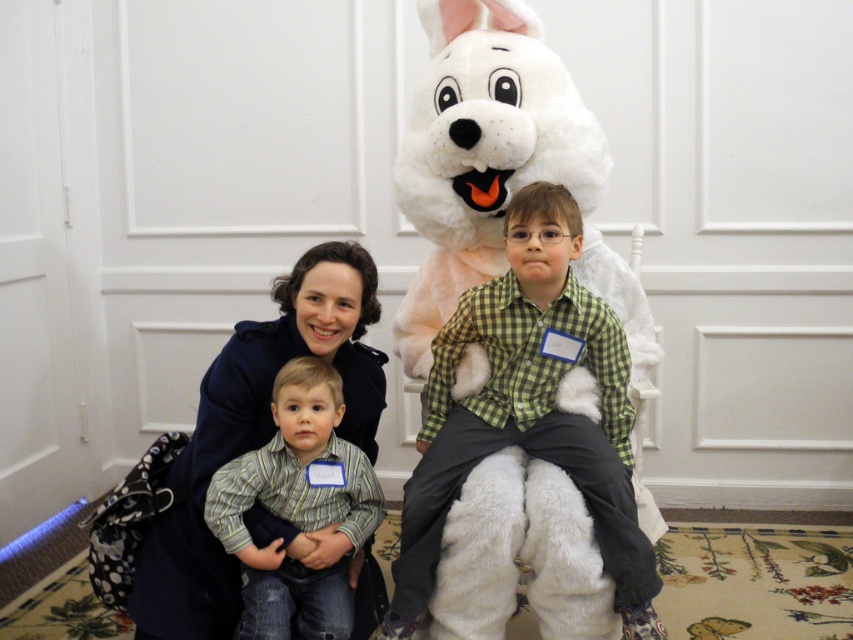
Is green checkered shirt at center shorter than striped shirt at center?

In fact, green checkered shirt at center may be taller than striped shirt at center.

This screenshot has height=640, width=853. Describe the element at coordinates (529, 410) in the screenshot. I see `green checkered shirt at center` at that location.

You are a GUI agent. You are given a task and a screenshot of the screen. Output one action in this format:
    pyautogui.click(x=<x>, y=<y>)
    Task: Click on the green checkered shirt at center
    
    Given the screenshot: What is the action you would take?
    pyautogui.click(x=529, y=410)

Find the location of a particular element. green checkered shirt at center is located at coordinates (529, 410).